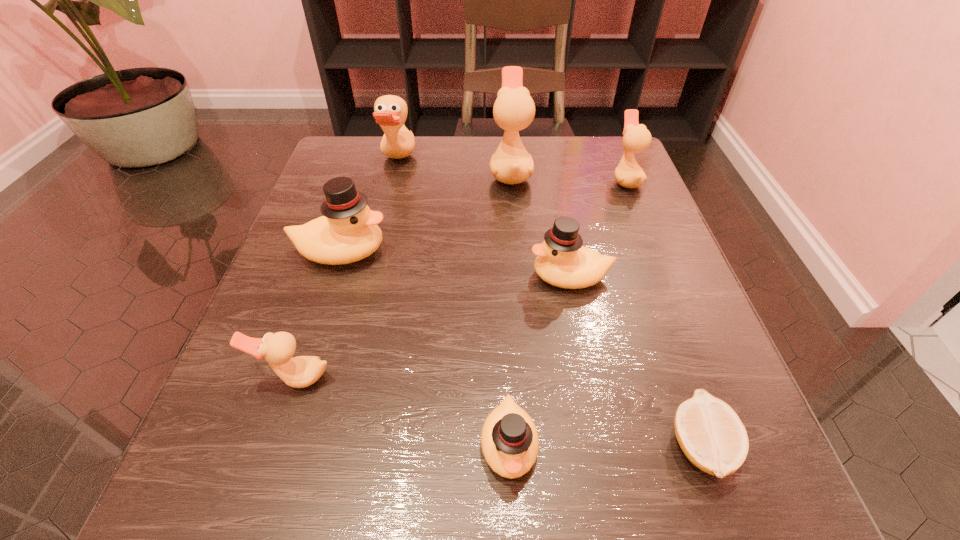
At what (x,y) coordinates should I click in order to perform the action: click on duck that is the third closest to the biggest yellow duck. Please return your answer as a coordinate pair (x, y). The height and width of the screenshot is (540, 960). Looking at the image, I should click on (514, 109).

You are a GUI agent. You are given a task and a screenshot of the screen. Output one action in this format:
    pyautogui.click(x=<x>, y=<y>)
    Task: Click on the duck that can be found as the fourth closest to the rightmost tan duck
    The width and height of the screenshot is (960, 540).
    Given the screenshot: What is the action you would take?
    pyautogui.click(x=348, y=232)

Choose which tan duck is the third nearest neighbor to the third biggest tan duck. Please provide its 2D coordinates. Your answer should be formatted as a tuple, i.e. [(x, y)], where the tuple contains the x and y coordinates of a point satisfying the conditions above.

[(278, 348)]

Locate an element on the screen. This screenshot has width=960, height=540. tan duck that is the third closest to the second nearest duck is located at coordinates (636, 138).

Locate an element on the screen. Image resolution: width=960 pixels, height=540 pixels. yellow duck that is the second closest one to the leftmost yellow duck is located at coordinates (509, 439).

Find the location of `yellow duck that can be found as the third closest to the lemon`. yellow duck that can be found as the third closest to the lemon is located at coordinates (348, 232).

Find the location of a particular element. This screenshot has width=960, height=540. vacant region that satisfies the following two spatial constraints: 1. on the front-facing side of the leftmost yellow duck; 2. on the right side of the lemon is located at coordinates (x=278, y=446).

The width and height of the screenshot is (960, 540). Find the location of `vacant position in the image that satisfies the following two spatial constraints: 1. on the front-facing side of the second biggest yellow duck; 2. on the right side of the lemon`. vacant position in the image that satisfies the following two spatial constraints: 1. on the front-facing side of the second biggest yellow duck; 2. on the right side of the lemon is located at coordinates (604, 446).

Image resolution: width=960 pixels, height=540 pixels. In order to click on vacant space that satisfies the following two spatial constraints: 1. on the beak of the third smallest tan duck; 2. on the beak of the nearest tan duck in this screenshot , I will do `click(346, 378)`.

You are a GUI agent. You are given a task and a screenshot of the screen. Output one action in this format:
    pyautogui.click(x=<x>, y=<y>)
    Task: Click on the free space that satisfies the following two spatial constraints: 1. on the beak of the third biggest tan duck; 2. on the beak of the smallest tan duck
    This screenshot has width=960, height=540.
    Given the screenshot: What is the action you would take?
    pyautogui.click(x=706, y=378)